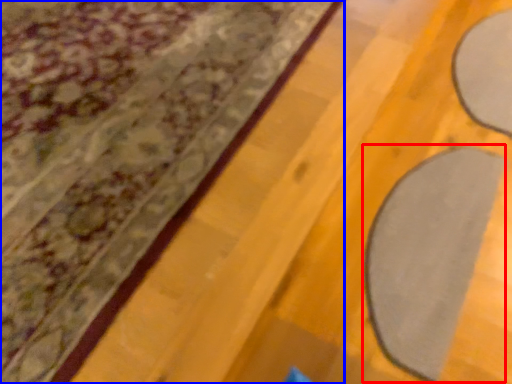
Question: Which object is closer to the camera taking this photo, yoga mat (highlighted by a red box) or curtain (highlighted by a blue box)?

Choices:
 (A) yoga mat
 (B) curtain

Answer: (B)